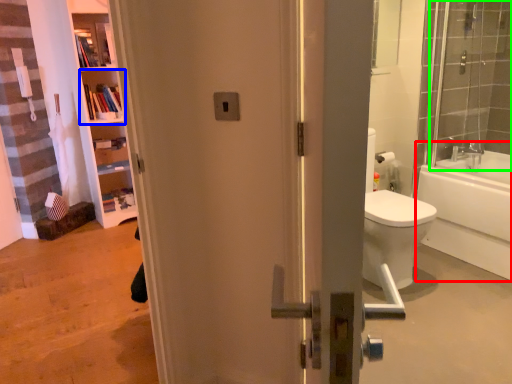
Question: Which is nearer to the bathtub (highlighted by a red box)? shelf (highlighted by a blue box) or shower door (highlighted by a green box).

Choices:
 (A) shelf
 (B) shower door

Answer: (B)